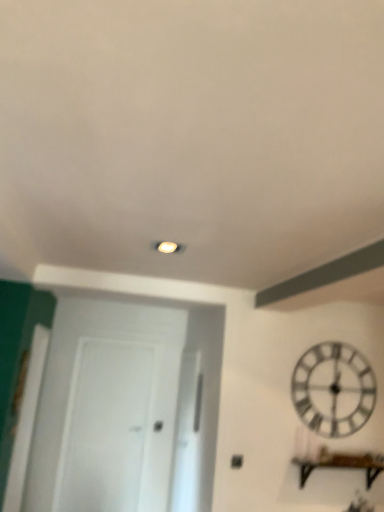
Question: Is transparent glass door at center, which is the 1th glass door in right-to-left order, positioned before brown wooden shelf at lower right?

Choices:
 (A) no
 (B) yes

Answer: (A)

Question: Is transparent glass door at center, the 2th glass door positioned from the left, smaller than brown wooden shelf at lower right?

Choices:
 (A) yes
 (B) no

Answer: (B)

Question: Can you confirm if transparent glass door at center, the 2th glass door positioned from the left, is taller than brown wooden shelf at lower right?

Choices:
 (A) no
 (B) yes

Answer: (B)

Question: From the image's perspective, is transparent glass door at center, the 2th glass door positioned from the left, under brown wooden shelf at lower right?

Choices:
 (A) no
 (B) yes

Answer: (B)

Question: Is transparent glass door at center, the 2th glass door positioned from the left, bigger than brown wooden shelf at lower right?

Choices:
 (A) yes
 (B) no

Answer: (A)

Question: From a real-world perspective, is transparent glass door at center, the 2th glass door positioned from the left, positioned under brown wooden shelf at lower right based on gravity?

Choices:
 (A) yes
 (B) no

Answer: (A)

Question: Does brown wooden shelf at lower right have a smaller size compared to transparent glass door at center, the 2th glass door positioned from the left?

Choices:
 (A) yes
 (B) no

Answer: (A)

Question: Is brown wooden shelf at lower right positioned in front of transparent glass door at center, the 2th glass door positioned from the left?

Choices:
 (A) no
 (B) yes

Answer: (B)

Question: Considering the relative sizes of brown wooden shelf at lower right and transparent glass door at center, the 2th glass door positioned from the left, in the image provided, is brown wooden shelf at lower right thinner than transparent glass door at center, the 2th glass door positioned from the left,?

Choices:
 (A) yes
 (B) no

Answer: (B)

Question: Does brown wooden shelf at lower right have a lesser height compared to transparent glass door at center, the 2th glass door positioned from the left?

Choices:
 (A) yes
 (B) no

Answer: (A)

Question: Can you confirm if brown wooden shelf at lower right is bigger than transparent glass door at center, which is the 1th glass door in right-to-left order?

Choices:
 (A) no
 (B) yes

Answer: (A)

Question: Considering the relative sizes of brown wooden shelf at lower right and transparent glass door at center, which is the 1th glass door in right-to-left order, in the image provided, is brown wooden shelf at lower right wider than transparent glass door at center, which is the 1th glass door in right-to-left order,?

Choices:
 (A) no
 (B) yes

Answer: (B)

Question: From a real-world perspective, is transparent glass door at center, arranged as the 2th glass door when viewed from the right, located higher than transparent glass door at center, which is the 1th glass door in right-to-left order?

Choices:
 (A) yes
 (B) no

Answer: (B)